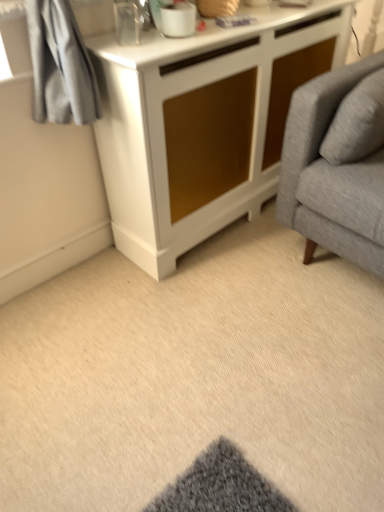
Question: Does white textured cabinet at center come in front of beige carpet at lower center?

Choices:
 (A) yes
 (B) no

Answer: (B)

Question: From a real-world perspective, is white textured cabinet at center under beige carpet at lower center?

Choices:
 (A) no
 (B) yes

Answer: (A)

Question: From a real-world perspective, is white textured cabinet at center on beige carpet at lower center?

Choices:
 (A) yes
 (B) no

Answer: (A)

Question: Is white textured cabinet at center outside of beige carpet at lower center?

Choices:
 (A) yes
 (B) no

Answer: (A)

Question: Is white textured cabinet at center facing towards beige carpet at lower center?

Choices:
 (A) yes
 (B) no

Answer: (A)

Question: Does white textured cabinet at center appear on the left side of beige carpet at lower center?

Choices:
 (A) yes
 (B) no

Answer: (B)

Question: Can you confirm if beige carpet at lower center is positioned to the left of white glossy mug at upper center?

Choices:
 (A) yes
 (B) no

Answer: (B)

Question: From the image's perspective, is beige carpet at lower center under white glossy mug at upper center?

Choices:
 (A) yes
 (B) no

Answer: (A)

Question: Is beige carpet at lower center oriented towards white glossy mug at upper center?

Choices:
 (A) yes
 (B) no

Answer: (B)

Question: From the image's perspective, is beige carpet at lower center on top of white glossy mug at upper center?

Choices:
 (A) no
 (B) yes

Answer: (A)

Question: Is there a large distance between beige carpet at lower center and white glossy mug at upper center?

Choices:
 (A) yes
 (B) no

Answer: (A)

Question: From a real-world perspective, is beige carpet at lower center on white glossy mug at upper center?

Choices:
 (A) yes
 (B) no

Answer: (B)

Question: From a real-world perspective, is beige carpet at lower center below white textured cabinet at center?

Choices:
 (A) no
 (B) yes

Answer: (B)